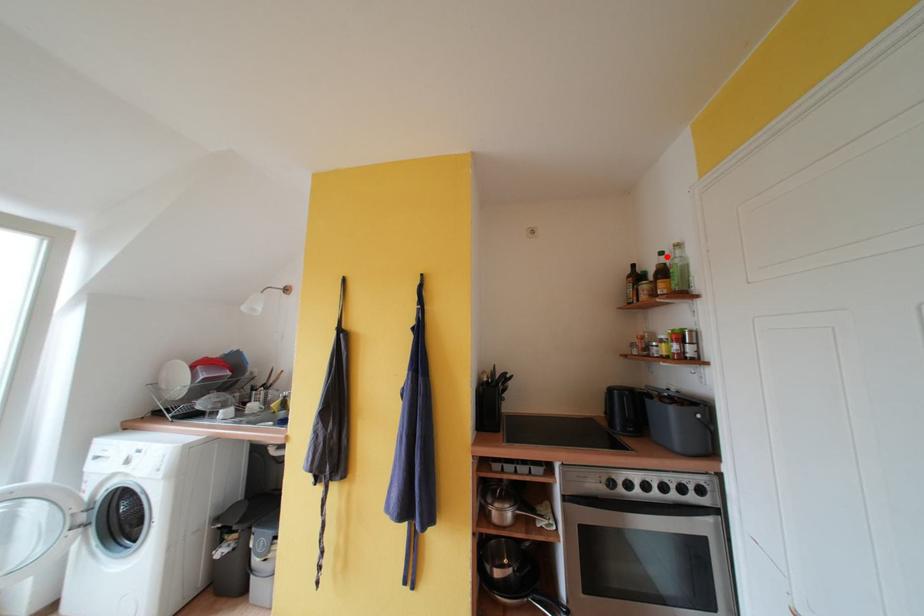
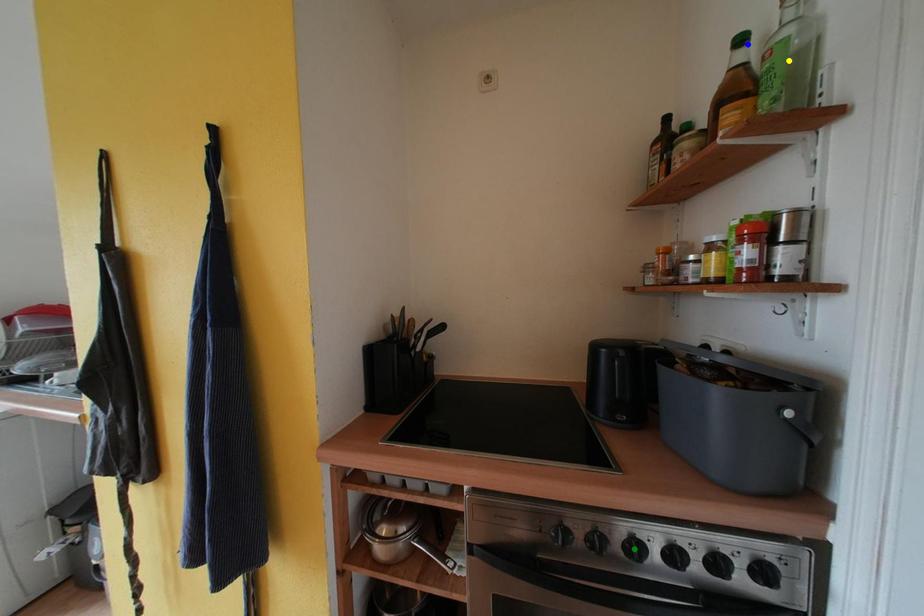
Question: I am providing you with two images of the same scene from different viewpoints. A red point is marked on the first image. You are given multiple points on the second image. Which point in image 2 represents the same 3d spot as the red point in image 1?

Choices:
 (A) green point
 (B) yellow point
 (C) blue point

Answer: (C)